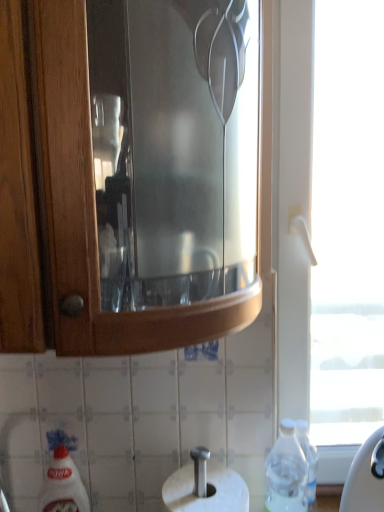
Question: Does transparent glass window at right have a lesser height compared to white glossy bottle at lower left?

Choices:
 (A) yes
 (B) no

Answer: (B)

Question: Is transparent glass window at right further to the viewer compared to white glossy bottle at lower left?

Choices:
 (A) no
 (B) yes

Answer: (B)

Question: Is transparent glass window at right directly adjacent to white glossy bottle at lower left?

Choices:
 (A) yes
 (B) no

Answer: (B)

Question: Is transparent glass window at right positioned before white glossy bottle at lower left?

Choices:
 (A) yes
 (B) no

Answer: (B)

Question: Is white glossy bottle at lower left inside transparent glass window at right?

Choices:
 (A) yes
 (B) no

Answer: (B)

Question: Is transparent glass window at right aimed at white glossy bottle at lower left?

Choices:
 (A) no
 (B) yes

Answer: (A)

Question: From a real-world perspective, is transparent glass window at right positioned under transparent plastic bottle at lower right based on gravity?

Choices:
 (A) yes
 (B) no

Answer: (B)

Question: Can you confirm if transparent glass window at right is thinner than transparent plastic bottle at lower right?

Choices:
 (A) yes
 (B) no

Answer: (A)

Question: Considering the relative sizes of transparent glass window at right and transparent plastic bottle at lower right in the image provided, is transparent glass window at right wider than transparent plastic bottle at lower right?

Choices:
 (A) yes
 (B) no

Answer: (B)

Question: From a real-world perspective, is transparent glass window at right physically above transparent plastic bottle at lower right?

Choices:
 (A) no
 (B) yes

Answer: (B)

Question: Is transparent glass window at right not near transparent plastic bottle at lower right?

Choices:
 (A) no
 (B) yes

Answer: (A)

Question: Is transparent glass window at right to the right of transparent plastic bottle at lower right from the viewer's perspective?

Choices:
 (A) no
 (B) yes

Answer: (B)

Question: Considering the relative positions of transparent plastic bottle at lower right and transparent glass window at right in the image provided, is transparent plastic bottle at lower right to the left of transparent glass window at right from the viewer's perspective?

Choices:
 (A) yes
 (B) no

Answer: (A)